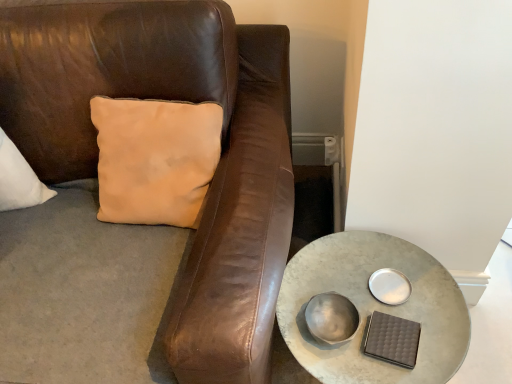
What do you see at coordinates (373, 308) in the screenshot?
I see `metallic gray table at lower right` at bounding box center [373, 308].

The width and height of the screenshot is (512, 384). What are the coordinates of `metallic gray table at lower right` in the screenshot? It's located at (373, 308).

Identify the location of metallic silver bowl at lower center. (331, 318).

Describe the element at coordinates (331, 318) in the screenshot. I see `metallic silver bowl at lower center` at that location.

The height and width of the screenshot is (384, 512). Find the location of `metallic gray table at lower right`. metallic gray table at lower right is located at coordinates (373, 308).

Is metallic gray table at lower right at the right side of metallic silver bowl at lower center?

Yes.

Which object is further away from the camera, metallic gray table at lower right or metallic silver bowl at lower center?

metallic silver bowl at lower center is behind.

Is point (315, 280) closer to camera compared to point (310, 326)?

No, it is not.

From the image's perspective, is metallic gray table at lower right under metallic silver bowl at lower center?

Correct, metallic gray table at lower right appears lower than metallic silver bowl at lower center in the image.

From the picture: From a real-world perspective, who is located higher, metallic gray table at lower right or metallic silver bowl at lower center?

metallic silver bowl at lower center.

Considering the relative sizes of metallic gray table at lower right and metallic silver bowl at lower center in the image provided, is metallic gray table at lower right thinner than metallic silver bowl at lower center?

In fact, metallic gray table at lower right might be wider than metallic silver bowl at lower center.

Which of these two, metallic gray table at lower right or metallic silver bowl at lower center, stands taller?

metallic gray table at lower right.

Looking at the image, does metallic gray table at lower right seem bigger or smaller compared to metallic silver bowl at lower center?

metallic gray table at lower right is bigger than metallic silver bowl at lower center.

Is metallic gray table at lower right situated inside metallic silver bowl at lower center or outside?

metallic gray table at lower right is not inside metallic silver bowl at lower center, it's outside.

Is metallic gray table at lower right far from metallic silver bowl at lower center?

metallic gray table at lower right is actually quite close to metallic silver bowl at lower center.

Is metallic gray table at lower right aimed at metallic silver bowl at lower center?

No, metallic gray table at lower right does not turn towards metallic silver bowl at lower center.

Can you tell me how much metallic gray table at lower right and metallic silver bowl at lower center differ in facing direction?

They differ by 0.000578 degrees in their facing directions.

Locate an element on the screen. table below the metallic silver bowl at lower center (from a real-world perspective) is located at coordinates (373, 308).

From the picture: Between metallic silver bowl at lower center and metallic gray table at lower right, which one appears on the left side from the viewer's perspective?

metallic silver bowl at lower center.

Between metallic silver bowl at lower center and metallic gray table at lower right, which one is positioned behind?

Positioned behind is metallic silver bowl at lower center.

Between point (326, 321) and point (308, 266), which one is positioned behind?

Positioned behind is point (308, 266).

From the image's perspective, between metallic silver bowl at lower center and metallic gray table at lower right, who is located below?

metallic gray table at lower right is shown below in the image.

From a real-world perspective, is metallic silver bowl at lower center physically below metallic gray table at lower right?

No, from a real-world perspective, metallic silver bowl at lower center is not beneath metallic gray table at lower right.

Is metallic silver bowl at lower center wider than metallic gray table at lower right?

No.

Is metallic silver bowl at lower center taller than metallic gray table at lower right?

In fact, metallic silver bowl at lower center may be shorter than metallic gray table at lower right.

Considering the sizes of objects metallic silver bowl at lower center and metallic gray table at lower right in the image provided, who is bigger, metallic silver bowl at lower center or metallic gray table at lower right?

Bigger between the two is metallic gray table at lower right.

Would you say metallic silver bowl at lower center is outside metallic gray table at lower right?

That's incorrect, metallic silver bowl at lower center is not completely outside metallic gray table at lower right.

Would you say metallic silver bowl at lower center is a long distance from metallic gray table at lower right?

That's not correct — metallic silver bowl at lower center is a little close to metallic gray table at lower right.

Is metallic silver bowl at lower center aimed at metallic gray table at lower right?

No, metallic silver bowl at lower center does not turn towards metallic gray table at lower right.

Can you tell me how much metallic silver bowl at lower center and metallic gray table at lower right differ in facing direction?

They differ by 0.000578 degrees in their facing directions.

The width and height of the screenshot is (512, 384). In order to click on table that is under the metallic silver bowl at lower center (from a real-world perspective) in this screenshot , I will do `click(373, 308)`.

The image size is (512, 384). I want to click on bowl that appears above the metallic gray table at lower right (from the image's perspective), so click(331, 318).

Where is `table in front of the metallic silver bowl at lower center`? This screenshot has height=384, width=512. table in front of the metallic silver bowl at lower center is located at coordinates (373, 308).